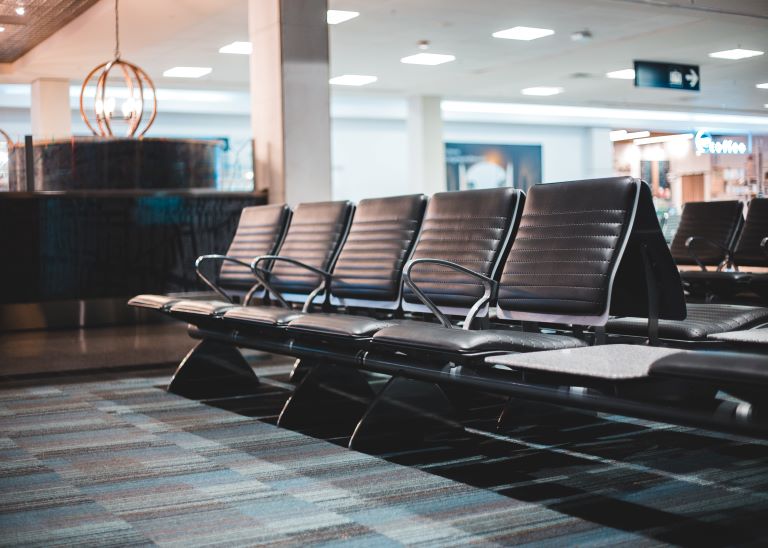
Identify the location of wall. This screenshot has height=548, width=768. (389, 148).